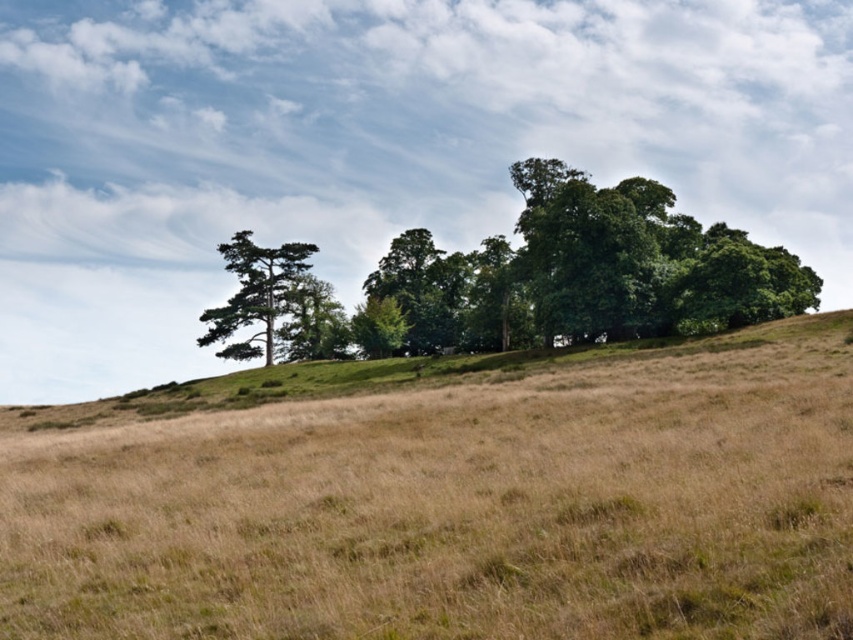
Is brown grassy hillside at center wider than green leafy tree at center?

No, brown grassy hillside at center is not wider than green leafy tree at center.

Is point (415, 400) positioned after point (561, 198)?

No, it is in front of (561, 198).

Where is `brown grassy hillside at center`? This screenshot has height=640, width=853. brown grassy hillside at center is located at coordinates (448, 499).

This screenshot has width=853, height=640. Identify the location of brown grassy hillside at center. (448, 499).

From the picture: Can you confirm if green leafy tree at center is shorter than green matte tree at left?

No.

What do you see at coordinates (525, 280) in the screenshot?
I see `green leafy tree at center` at bounding box center [525, 280].

Find the location of `green leafy tree at center`. green leafy tree at center is located at coordinates (525, 280).

Which is below, brown grassy hillside at center or green matte tree at left?

brown grassy hillside at center is lower down.

Who is shorter, brown grassy hillside at center or green matte tree at left?

brown grassy hillside at center is shorter.

Between point (436, 580) and point (270, 300), which one is positioned behind?

The point (270, 300) is behind.

At what (x,y) coordinates should I click in order to perform the action: click on brown grassy hillside at center. Please return your answer as a coordinate pair (x, y). This screenshot has height=640, width=853. Looking at the image, I should click on (448, 499).